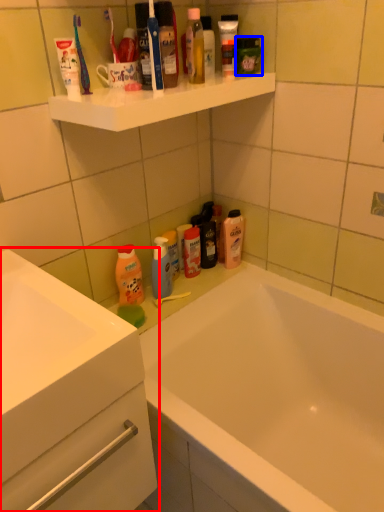
Question: Which object is further to the camera taking this photo, bathroom cabinet (highlighted by a red box) or toiletry (highlighted by a blue box)?

Choices:
 (A) bathroom cabinet
 (B) toiletry

Answer: (B)